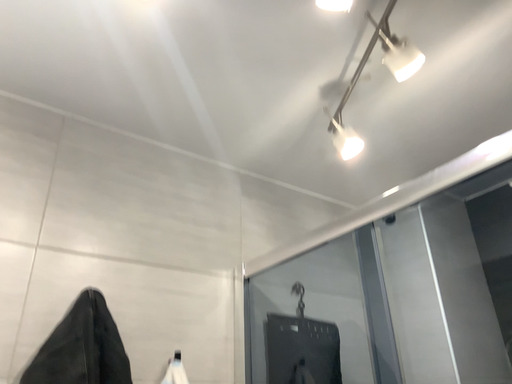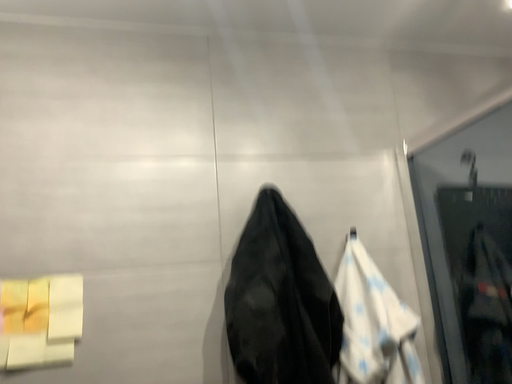
Question: How did the camera likely rotate when shooting the video?

Choices:
 (A) rotated right
 (B) rotated left

Answer: (B)